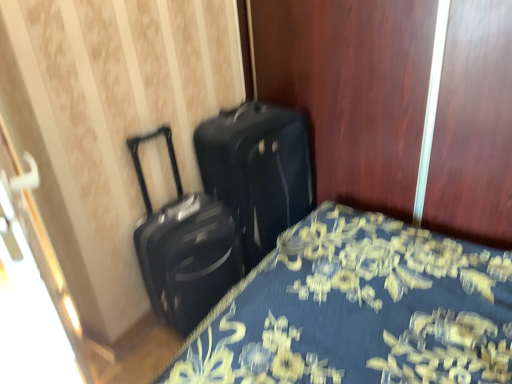
Question: From a real-world perspective, does black matte suitcase at center, acting as the 1th suitcase starting from the left, stand above black matte suitcase at center, arranged as the 1th suitcase when viewed from the right?

Choices:
 (A) no
 (B) yes

Answer: (B)

Question: Is black matte suitcase at center, acting as the 1th suitcase starting from the left, touching black matte suitcase at center, arranged as the second suitcase when viewed from the left?

Choices:
 (A) no
 (B) yes

Answer: (A)

Question: Could you tell me if black matte suitcase at center, acting as the 1th suitcase starting from the left, is facing black matte suitcase at center, arranged as the second suitcase when viewed from the left?

Choices:
 (A) yes
 (B) no

Answer: (A)

Question: From the image's perspective, is black matte suitcase at center, the second suitcase when ordered from right to left, on black matte suitcase at center, arranged as the second suitcase when viewed from the left?

Choices:
 (A) no
 (B) yes

Answer: (A)

Question: Is black matte suitcase at center, the second suitcase when ordered from right to left, smaller than black matte suitcase at center, arranged as the 1th suitcase when viewed from the right?

Choices:
 (A) no
 (B) yes

Answer: (B)

Question: From the image's perspective, does black matte suitcase at center, the second suitcase when ordered from right to left, appear lower than black matte suitcase at center, arranged as the 1th suitcase when viewed from the right?

Choices:
 (A) yes
 (B) no

Answer: (A)

Question: Can you confirm if black matte suitcase at center, arranged as the 1th suitcase when viewed from the right, is smaller than black matte suitcase at center, acting as the 1th suitcase starting from the left?

Choices:
 (A) no
 (B) yes

Answer: (A)

Question: Is black matte suitcase at center, arranged as the second suitcase when viewed from the left, positioned far away from black matte suitcase at center, acting as the 1th suitcase starting from the left?

Choices:
 (A) no
 (B) yes

Answer: (A)

Question: Can you confirm if black matte suitcase at center, arranged as the second suitcase when viewed from the left, is thinner than black matte suitcase at center, the second suitcase when ordered from right to left?

Choices:
 (A) no
 (B) yes

Answer: (A)

Question: Is black matte suitcase at center, arranged as the second suitcase when viewed from the left, to the right of black matte suitcase at center, the second suitcase when ordered from right to left, from the viewer's perspective?

Choices:
 (A) yes
 (B) no

Answer: (A)

Question: Would you say black matte suitcase at center, acting as the 1th suitcase starting from the left, is part of black matte suitcase at center, arranged as the 1th suitcase when viewed from the right,'s contents?

Choices:
 (A) no
 (B) yes

Answer: (A)

Question: Is black matte suitcase at center, arranged as the second suitcase when viewed from the left, next to black matte suitcase at center, acting as the 1th suitcase starting from the left, and touching it?

Choices:
 (A) yes
 (B) no

Answer: (B)

Question: Does black matte suitcase at center, acting as the 1th suitcase starting from the left, appear on the right side of blue floral fabric bed at lower left?

Choices:
 (A) yes
 (B) no

Answer: (B)